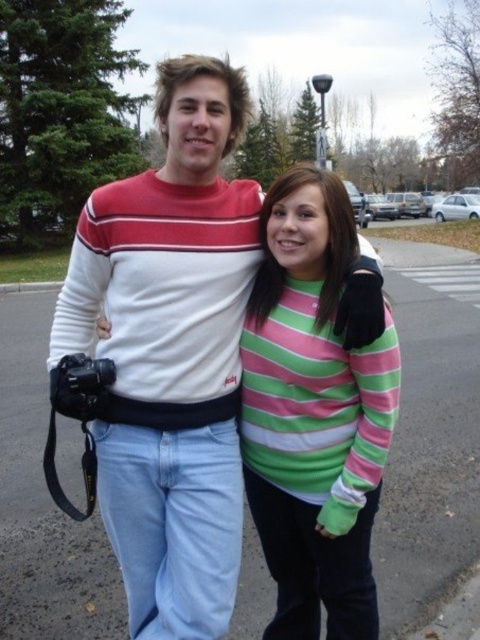
You are trying to decide which sweater to wear for a casual day out. Both the white striped sweater at center and the striped cotton sweater at center are options. Based on their sizes, which one would you choose if you prefer a wider fit?

The white striped sweater at center is wider than the striped cotton sweater at center, so you should choose the white striped sweater at center for a wider fit.

You are standing at a point 6.08 feet away from the camera attached to the person on the left. Can you estimate how far you are from the point marked at coordinates point (176, 321)?

The distance of point (176, 321) from viewer is 6.08 feet, so you are exactly 6.08 feet away from the point marked at coordinates point 0.502, 0.502.

Based on the coordinates provided, which object corresponds to the point at [169,353]?

The point at [169,353] corresponds to the white striped sweater at center.